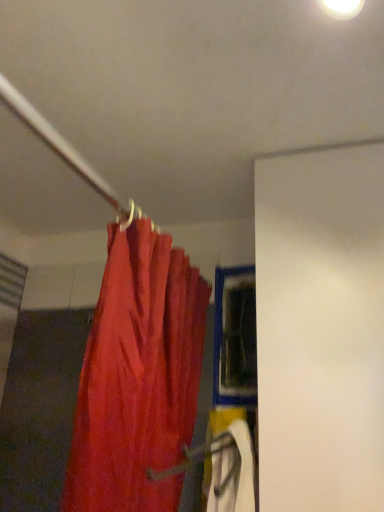
Question: Is blue plastic window at center inside or outside of matte red curtain at upper left?

Choices:
 (A) inside
 (B) outside

Answer: (B)

Question: Looking at their shapes, would you say blue plastic window at center is wider or thinner than matte red curtain at upper left?

Choices:
 (A) thin
 (B) wide

Answer: (A)

Question: In terms of height, does blue plastic window at center look taller or shorter compared to matte red curtain at upper left?

Choices:
 (A) short
 (B) tall

Answer: (A)

Question: In the image, is matte red curtain at upper left on the left side or the right side of blue plastic window at center?

Choices:
 (A) right
 (B) left

Answer: (B)

Question: Considering the positions of point (170, 452) and point (256, 370), is point (170, 452) closer or farther from the camera than point (256, 370)?

Choices:
 (A) farther
 (B) closer

Answer: (B)

Question: Choose the correct answer: Is matte red curtain at upper left inside blue plastic window at center or outside it?

Choices:
 (A) outside
 (B) inside

Answer: (A)

Question: Is matte red curtain at upper left bigger or smaller than blue plastic window at center?

Choices:
 (A) big
 (B) small

Answer: (A)